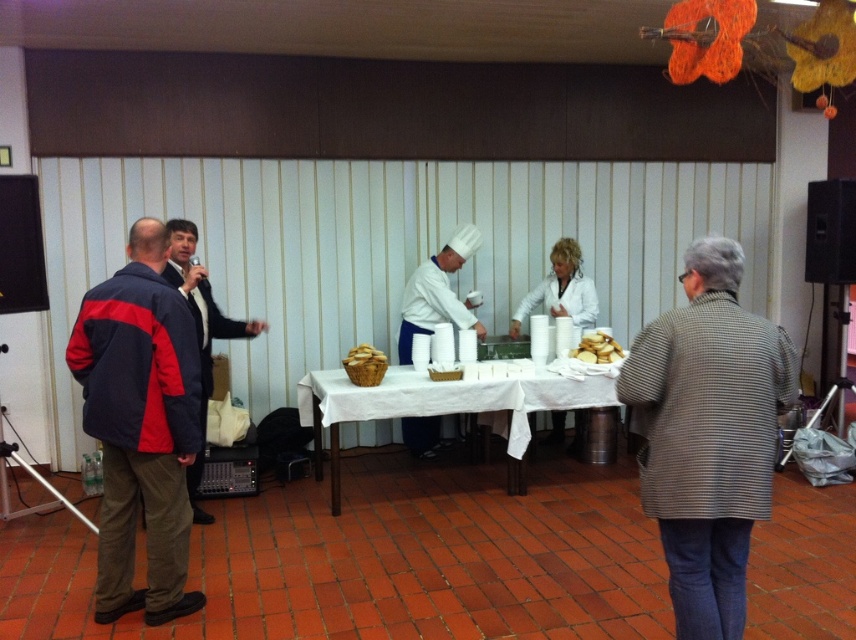
Which is more to the right, red and navy blue jacket at left or white cloth-covered table at center?

white cloth-covered table at center is more to the right.

Does red and navy blue jacket at left have a greater height compared to white cloth-covered table at center?

Yes, red and navy blue jacket at left is taller than white cloth-covered table at center.

Between point (158, 420) and point (428, 397), which one is positioned behind?

The point (428, 397) is behind.

The width and height of the screenshot is (856, 640). Identify the location of red and navy blue jacket at left. (140, 426).

Based on the photo, is white cloth-covered table at center below matte black jacket at left?

Yes.

How distant is white cloth-covered table at center from matte black jacket at left?

The distance of white cloth-covered table at center from matte black jacket at left is 36.90 inches.

Is point (504, 404) farther from viewer compared to point (198, 310)?

That is True.

The width and height of the screenshot is (856, 640). What are the coordinates of `white cloth-covered table at center` in the screenshot? It's located at (411, 412).

Is white matte chef hat at center wider than matte black jacket at left?

Correct, the width of white matte chef hat at center exceeds that of matte black jacket at left.

Identify the location of white matte chef hat at center. (437, 292).